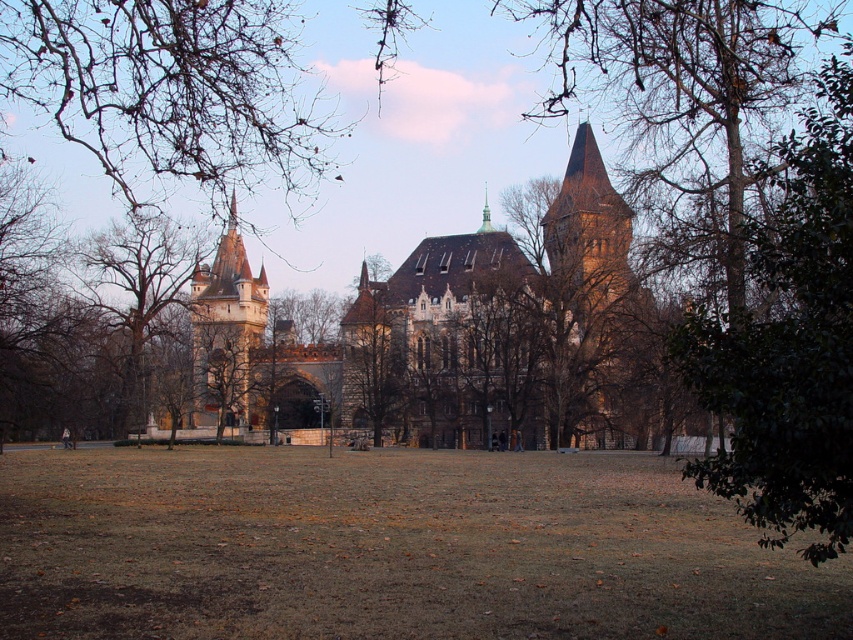
Is point (838, 275) closer to viewer compared to point (485, 186)?

Yes, it is in front of point (485, 186).

Can you confirm if green leafy tree at right is positioned below smooth gold spire at upper center?

Indeed, green leafy tree at right is positioned under smooth gold spire at upper center.

Between point (756, 508) and point (486, 218), which one is positioned in front?

Point (756, 508) is in front.

Where is `green leafy tree at right`? green leafy tree at right is located at coordinates (788, 342).

Which is more to the left, brown stone church at center or green leafy tree at right?

Positioned to the left is brown stone church at center.

Describe the element at coordinates (457, 337) in the screenshot. I see `brown stone church at center` at that location.

This screenshot has width=853, height=640. In order to click on brown stone church at center in this screenshot , I will do `click(457, 337)`.

Can you confirm if brown stone church at center is positioned below brown stone tower at center?

Yes.

Does brown stone church at center have a greater height compared to brown stone tower at center?

Yes, brown stone church at center is taller than brown stone tower at center.

Locate an element on the screen. brown stone church at center is located at coordinates (457, 337).